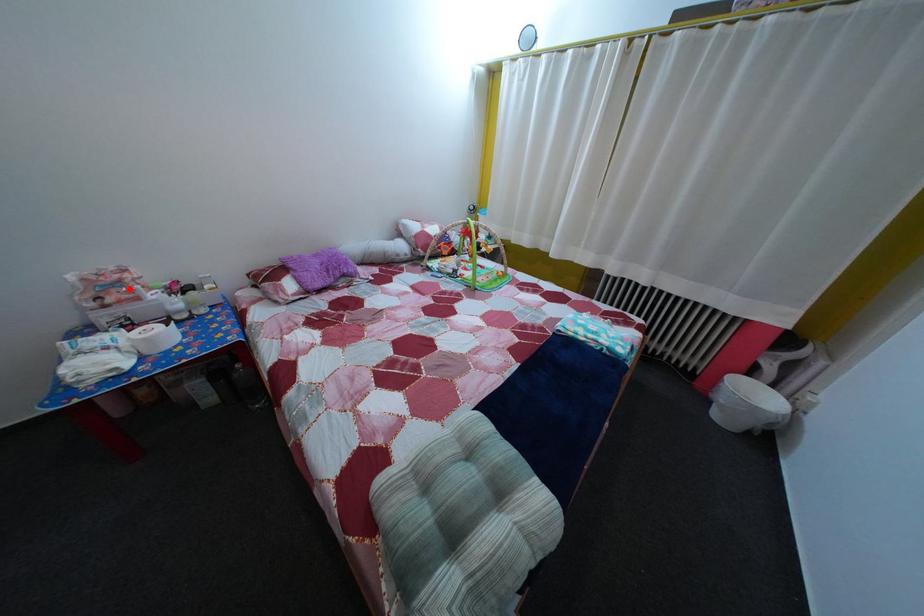
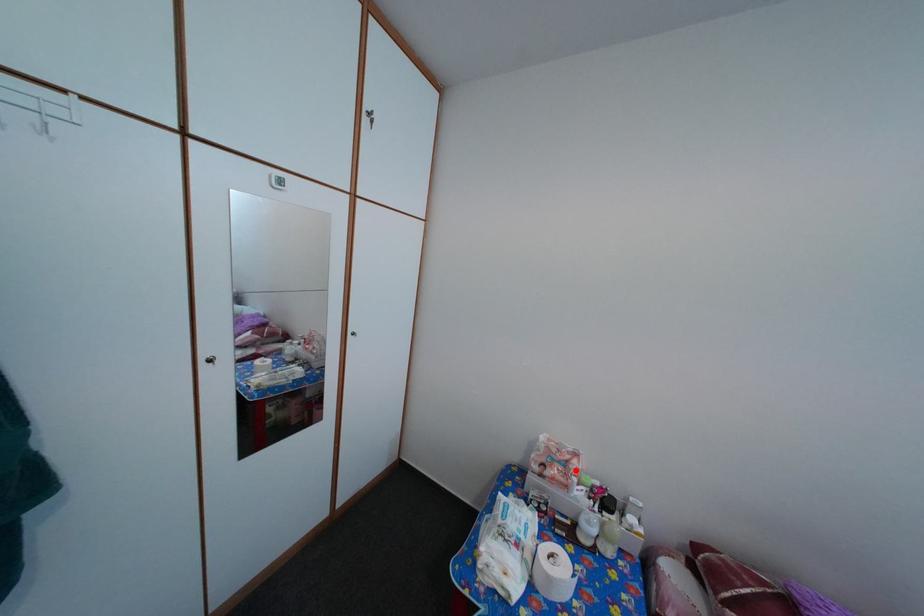
I am providing you with two images of the same scene from different viewpoints. A red point is marked on the first image and another point is marked on the second image. Do the highlighted points in image1 and image2 indicate the same real-world spot?

Yes